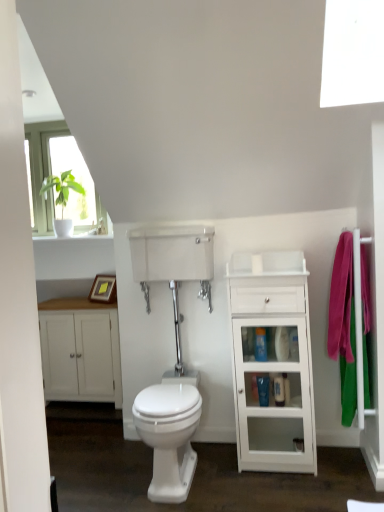
Question: Is blue glossy toiletries at center, the first toiletry in the left-to-right sequence, smaller than white glossy bidet at center?

Choices:
 (A) no
 (B) yes

Answer: (B)

Question: Can you confirm if blue glossy toiletries at center, positioned as the 2th toiletry in right-to-left order, is thinner than white glossy bidet at center?

Choices:
 (A) yes
 (B) no

Answer: (A)

Question: From a real-world perspective, does blue glossy toiletries at center, positioned as the 2th toiletry in right-to-left order, sit lower than white glossy bidet at center?

Choices:
 (A) yes
 (B) no

Answer: (B)

Question: Is blue glossy toiletries at center, positioned as the 2th toiletry in right-to-left order, oriented away from white glossy bidet at center?

Choices:
 (A) no
 (B) yes

Answer: (A)

Question: Would you say blue glossy toiletries at center, the first toiletry in the left-to-right sequence, contains white glossy bidet at center?

Choices:
 (A) no
 (B) yes

Answer: (A)

Question: Is white matte cabinet at left in front of or behind blue glossy toiletries at center, the 2th toiletry when ordered from bottom to top, in the image?

Choices:
 (A) behind
 (B) front

Answer: (A)

Question: From a real-world perspective, relative to blue glossy toiletries at center, the first toiletry in the left-to-right sequence, is white matte cabinet at left vertically above or below?

Choices:
 (A) below
 (B) above

Answer: (A)

Question: In terms of width, does white matte cabinet at left look wider or thinner when compared to blue glossy toiletries at center, the 2th toiletry when ordered from bottom to top?

Choices:
 (A) wide
 (B) thin

Answer: (A)

Question: From the image's perspective, is white matte cabinet at left located above or below blue glossy toiletries at center, positioned as the 2th toiletry in right-to-left order?

Choices:
 (A) below
 (B) above

Answer: (A)

Question: Is blue glossy toiletries at center, which is the first toiletry in bottom-to-top order, inside or outside of white glossy cabinet at right?

Choices:
 (A) outside
 (B) inside

Answer: (B)

Question: Considering the positions of blue glossy toiletries at center, which is the first toiletry in bottom-to-top order, and white glossy cabinet at right in the image, is blue glossy toiletries at center, which is the first toiletry in bottom-to-top order, wider or thinner than white glossy cabinet at right?

Choices:
 (A) thin
 (B) wide

Answer: (A)

Question: Would you say blue glossy toiletries at center, which appears as the second toiletry when viewed from the left, is to the left or to the right of white glossy cabinet at right in the picture?

Choices:
 (A) left
 (B) right

Answer: (B)

Question: Considering the positions of point (279, 379) and point (256, 458), is point (279, 379) closer or farther from the camera than point (256, 458)?

Choices:
 (A) farther
 (B) closer

Answer: (A)

Question: In terms of height, does white glossy bidet at center look taller or shorter compared to blue glossy toiletries at center, the first toiletry in the left-to-right sequence?

Choices:
 (A) tall
 (B) short

Answer: (A)

Question: Is white glossy bidet at center inside or outside of blue glossy toiletries at center, the first toiletry in the left-to-right sequence?

Choices:
 (A) outside
 (B) inside

Answer: (A)